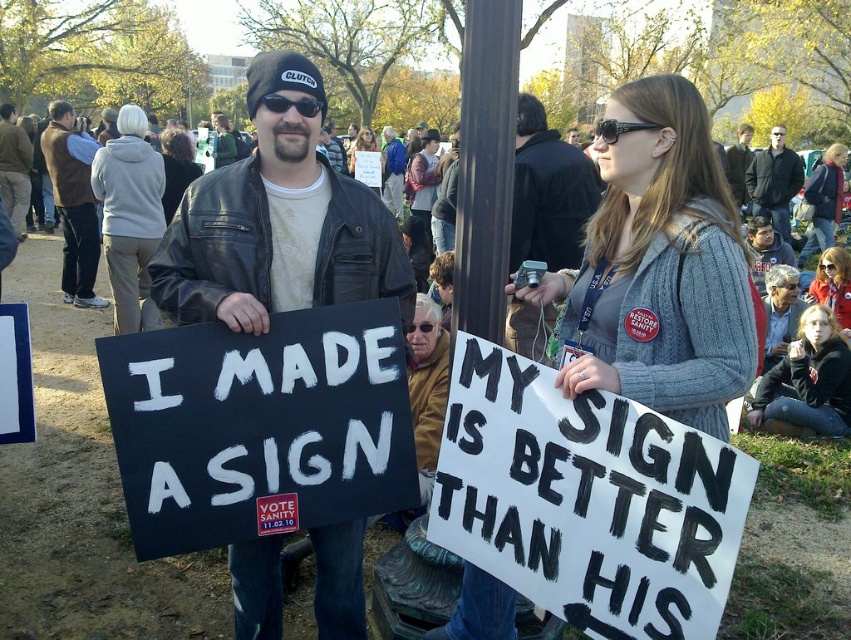
What is the relationship in height between the brown suede vest at left and the dark brown hair at center in the scene?

The brown suede vest at left is taller than the dark brown hair at center.